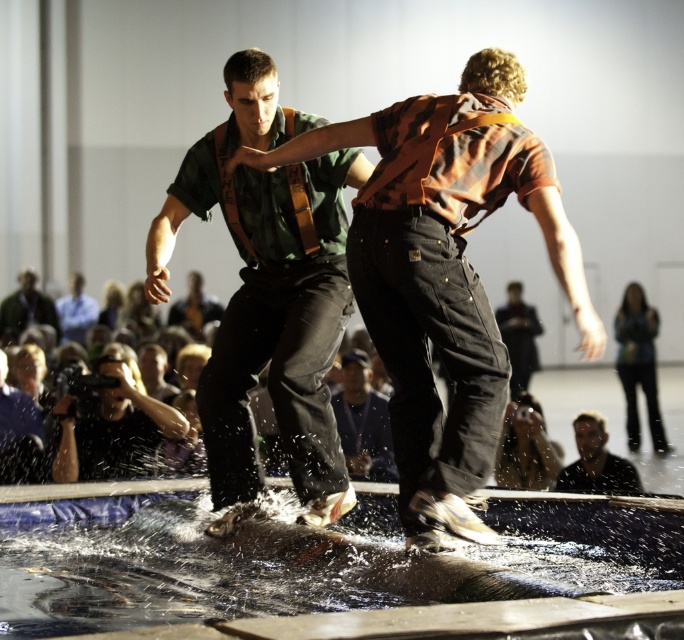
Question: Can you confirm if orange cotton shirt at center is positioned to the left of dark gray jeans at center?

Choices:
 (A) yes
 (B) no

Answer: (A)

Question: Does dark gray fabric pants at center have a smaller size compared to smooth skin face at lower right?

Choices:
 (A) yes
 (B) no

Answer: (B)

Question: Is black fabric camera at right smaller than smooth skin face at lower right?

Choices:
 (A) no
 (B) yes

Answer: (A)

Question: Which object appears farthest from the camera in this image?

Choices:
 (A) smooth skin face at lower right
 (B) orange cotton shirt at center
 (C) dark gray fabric pants at center

Answer: (C)

Question: Which point is farther to the camera?

Choices:
 (A) (618, 369)
 (B) (127, 445)
 (C) (529, 342)
 (D) (601, 483)

Answer: (C)

Question: Based on their relative distances, which object is farther from the dark gray jeans at center?

Choices:
 (A) dark gray fabric jacket at lower left
 (B) clear liquid water at center
 (C) matte black camera at lower left

Answer: (B)